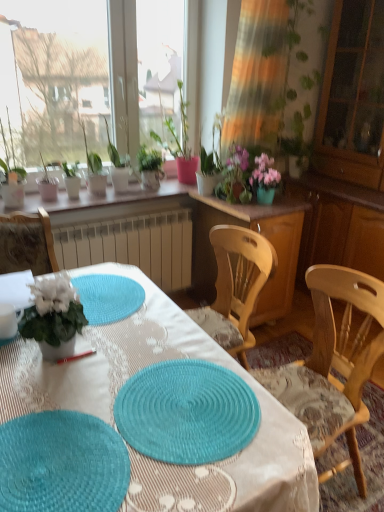
What are the coordinates of `spots to the right of teal woven mat at lower left, positioned as the 2th mat in right-to-left order` in the screenshot? It's located at (198, 441).